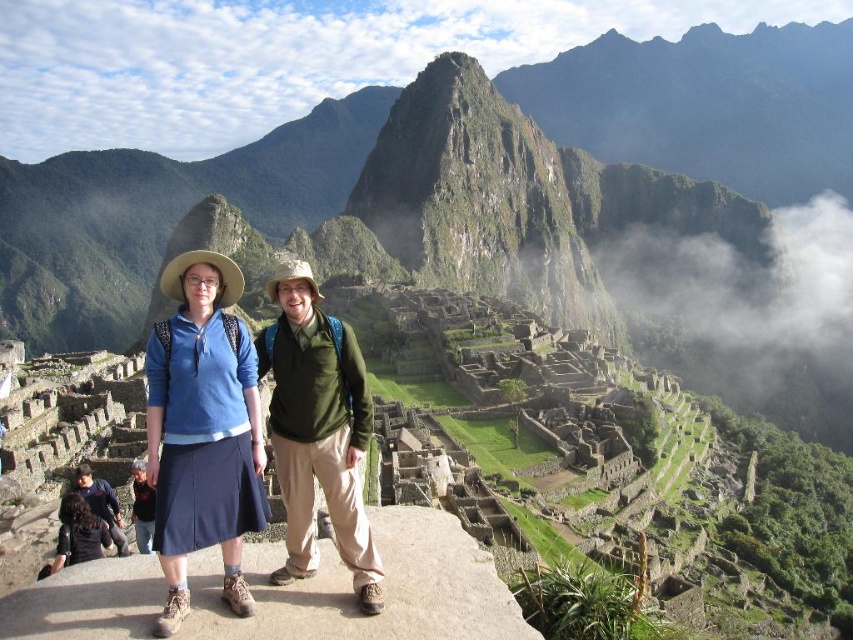
Can you confirm if green grassy mountain at center is shorter than green matte vest at center?

In fact, green grassy mountain at center may be taller than green matte vest at center.

Does green grassy mountain at center have a greater width compared to green matte vest at center?

Yes, green grassy mountain at center is wider than green matte vest at center.

The height and width of the screenshot is (640, 853). In order to click on green grassy mountain at center in this screenshot , I will do `click(157, 216)`.

Can you confirm if green grassy mountain at center is bigger than blue fabric shirt at center?

Indeed, green grassy mountain at center has a larger size compared to blue fabric shirt at center.

Between green grassy mountain at center and blue fabric shirt at center, which one is positioned higher?

green grassy mountain at center

This screenshot has height=640, width=853. What do you see at coordinates (157, 216) in the screenshot?
I see `green grassy mountain at center` at bounding box center [157, 216].

The height and width of the screenshot is (640, 853). In order to click on green grassy mountain at center in this screenshot , I will do `click(157, 216)`.

Does blue fabric shirt at center lie behind dark brown leather jacket at lower left?

No, it is in front of dark brown leather jacket at lower left.

Can you confirm if blue fabric shirt at center is taller than dark brown leather jacket at lower left?

Indeed, blue fabric shirt at center has a greater height compared to dark brown leather jacket at lower left.

In order to click on blue fabric shirt at center in this screenshot , I will do `click(202, 429)`.